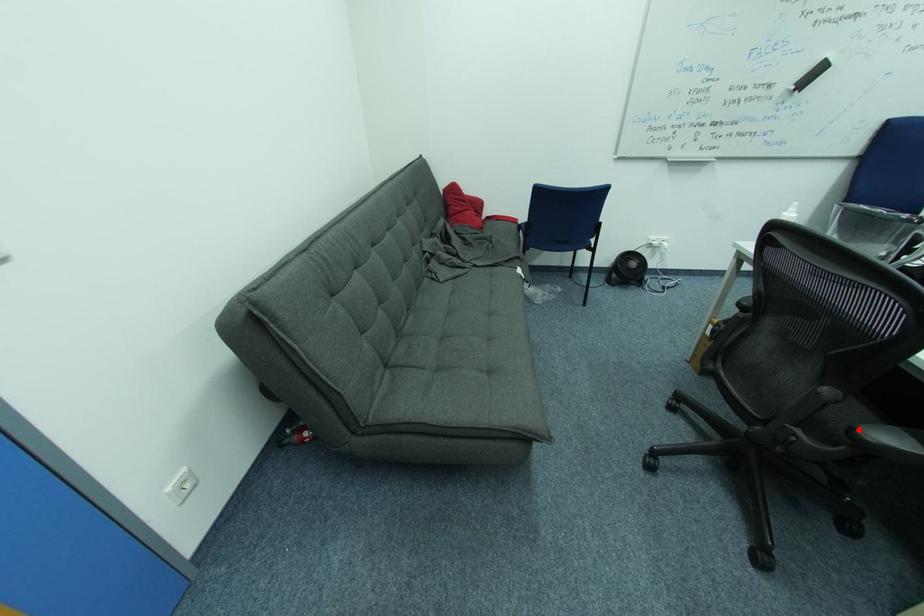
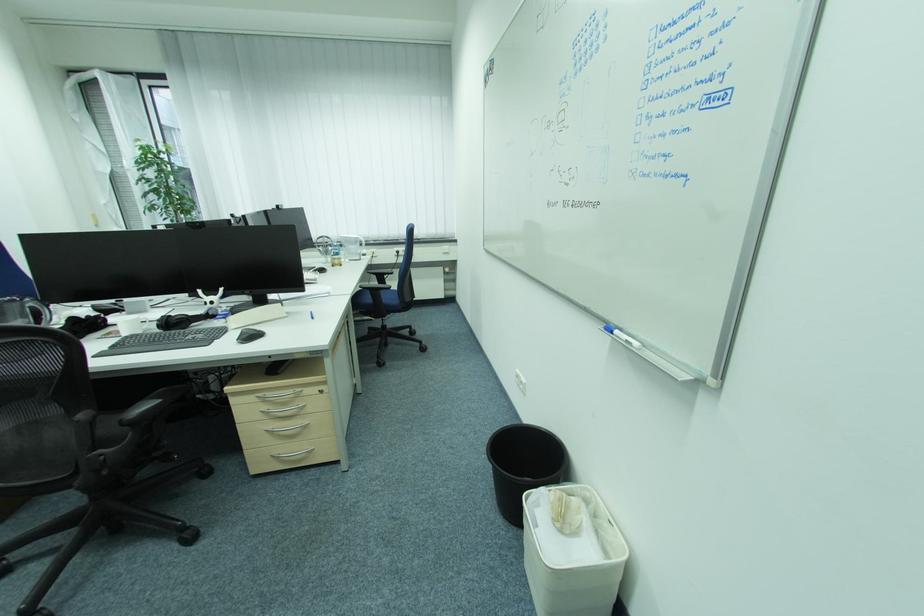
Question: I am providing you with two images of the same scene from different viewpoints. A red point is shown in image1. For the corresponding object point in image2, is it positioned nearer or farther from the camera?

Choices:
 (A) Nearer
 (B) Farther

Answer: (B)